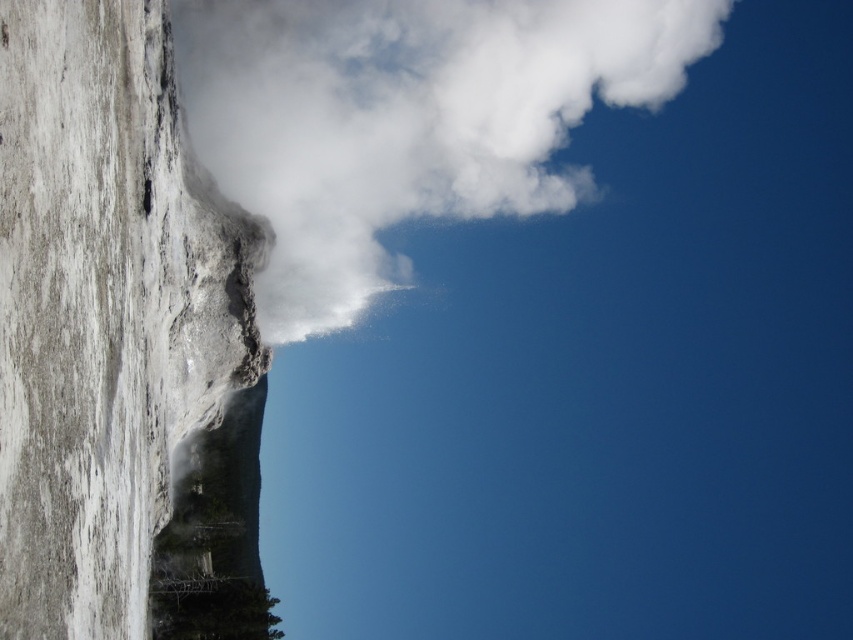
Question: Does white stone rock face at left have a greater width compared to white vapor cloud at upper center?

Choices:
 (A) yes
 (B) no

Answer: (B)

Question: Which point appears farthest from the camera in this image?

Choices:
 (A) (202, 413)
 (B) (280, 228)

Answer: (B)

Question: Which of the following is the farthest from the observer?

Choices:
 (A) (164, 458)
 (B) (468, 124)

Answer: (B)

Question: Is white stone rock face at left positioned in front of white vapor cloud at upper center?

Choices:
 (A) no
 (B) yes

Answer: (B)

Question: Which object appears farthest from the camera in this image?

Choices:
 (A) white vapor cloud at upper center
 (B) white stone rock face at left

Answer: (A)

Question: Is white stone rock face at left thinner than white vapor cloud at upper center?

Choices:
 (A) no
 (B) yes

Answer: (B)